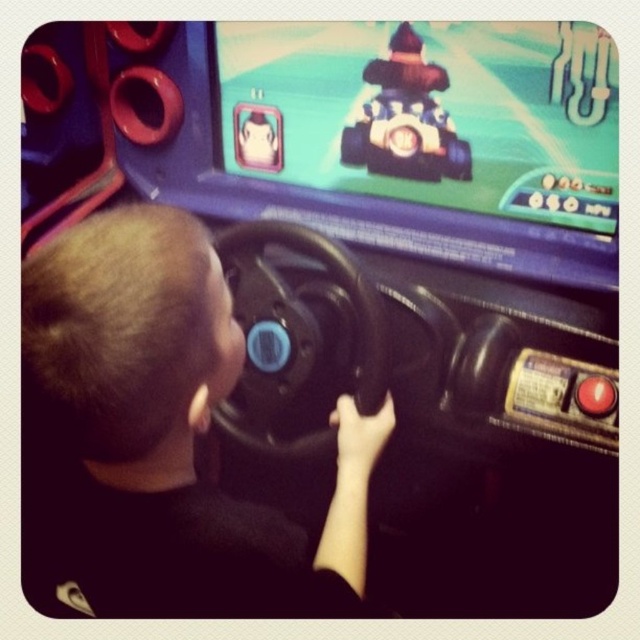
Question: Does black matte steering wheel at center have a lesser width compared to shiny blue plastic toy car at center?

Choices:
 (A) no
 (B) yes

Answer: (A)

Question: Can you confirm if black plastic steering wheel at center is positioned below shiny blue plastic toy car at center?

Choices:
 (A) yes
 (B) no

Answer: (A)

Question: Can you confirm if black matte steering wheel at center is positioned above black plastic steering wheel at center?

Choices:
 (A) no
 (B) yes

Answer: (A)

Question: Among these objects, which one is farthest from the camera?

Choices:
 (A) black plastic steering wheel at center
 (B) black matte steering wheel at center
 (C) shiny blue plastic toy car at center

Answer: (C)

Question: Considering the real-world distances, which object is closest to the black matte steering wheel at center?

Choices:
 (A) shiny blue plastic toy car at center
 (B) black plastic steering wheel at center

Answer: (B)

Question: Estimate the real-world distances between objects in this image. Which object is closer to the shiny blue plastic toy car at center?

Choices:
 (A) black matte steering wheel at center
 (B) black plastic steering wheel at center

Answer: (B)